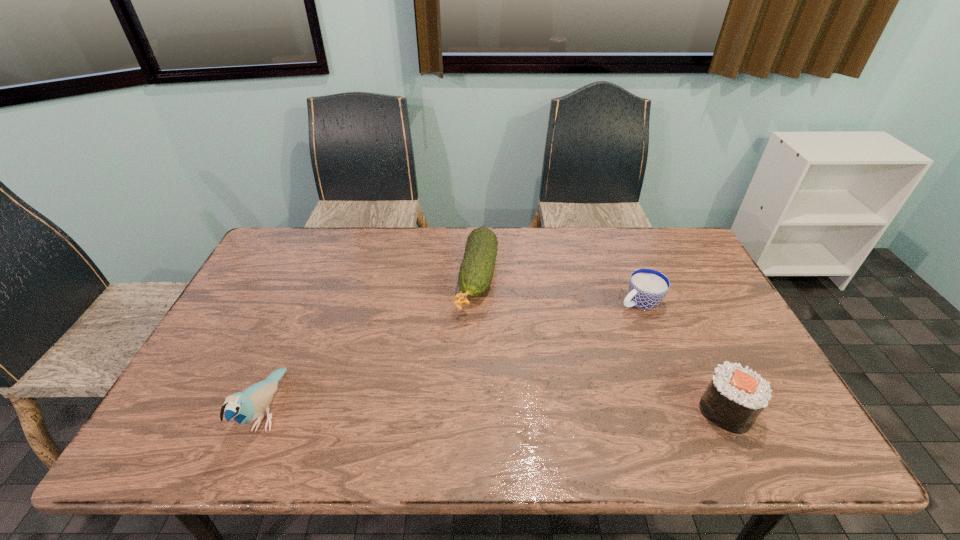
At what (x,y) coordinates should I click in order to perform the action: click on vacant area located 0.290m on the side of the shortest object with the handle. Please return your answer as a coordinate pair (x, y). Looking at the image, I should click on (545, 350).

Image resolution: width=960 pixels, height=540 pixels. Find the location of `vacant point located on the side of the shortest object with the handle`. vacant point located on the side of the shortest object with the handle is located at coordinates click(x=579, y=333).

You are a GUI agent. You are given a task and a screenshot of the screen. Output one action in this format:
    pyautogui.click(x=<x>, y=<y>)
    Task: Click on the object at the far edge
    The height and width of the screenshot is (540, 960).
    Given the screenshot: What is the action you would take?
    pyautogui.click(x=477, y=268)

Find the location of a particular element. Image resolution: width=960 pixels, height=540 pixels. bird that is positioned at the near edge is located at coordinates (244, 407).

Where is `sushi present at the near edge`? sushi present at the near edge is located at coordinates (735, 397).

Locate an element on the screen. Image resolution: width=960 pixels, height=540 pixels. object that is at the right edge is located at coordinates tap(735, 397).

Where is `object that is at the near right corner`? This screenshot has height=540, width=960. object that is at the near right corner is located at coordinates (735, 397).

The height and width of the screenshot is (540, 960). In the image, there is a desktop. In order to click on free space at the far edge in this screenshot , I will do `click(457, 259)`.

The width and height of the screenshot is (960, 540). I want to click on vacant space at the left edge, so click(242, 360).

In the image, there is a desktop. Identify the location of vacant space at the right edge. The width and height of the screenshot is (960, 540). (720, 354).